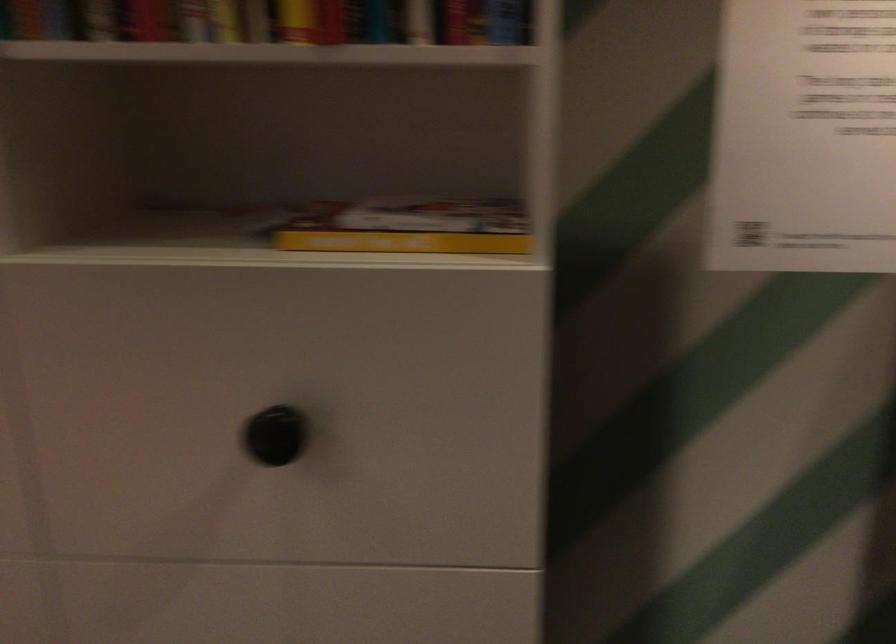
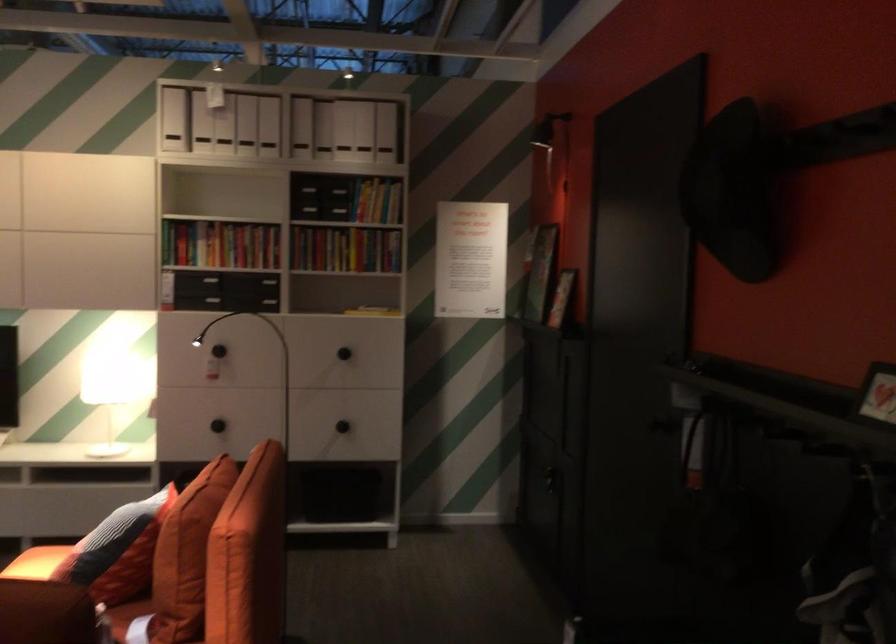
Where in the second image is the point corresponding to the point at 455,276 from the first image?

(372, 310)